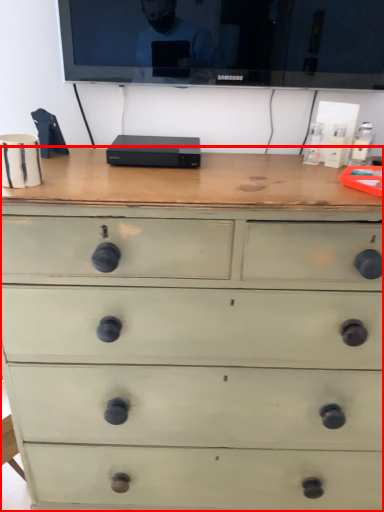
Question: From the image's perspective, where is chest of drawers (annotated by the red box) located in relation to television in the image?

Choices:
 (A) above
 (B) below

Answer: (B)